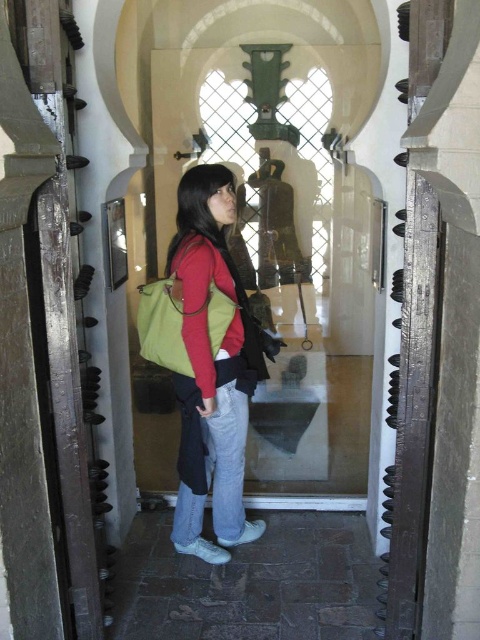
You are a photographer trying to capture a clear shot of the person in the scene. Since both the matte green bag at center and the green fabric bag at center are in the frame, which one should you focus on to ensure the person is in focus?

The matte green bag at center is below the green fabric bag at center, so focusing on the green fabric bag at center would place the person in focus since it is closer to their position.

You are a photographer trying to decide which bag to use for your equipment. You have two bags in front of you, the matte green bag at center and the green fabric bag at center. Which one has a larger capacity?

The matte green bag at center is bigger than the green fabric bag at center, so it has a larger capacity.